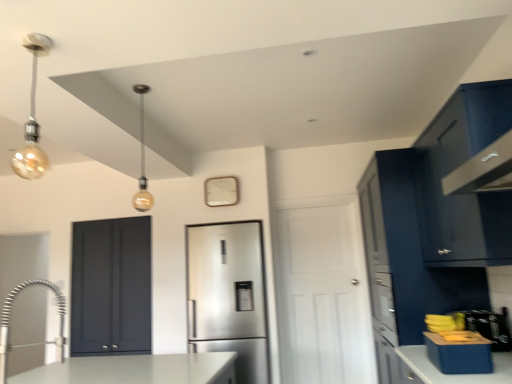
Question: In the image, is gold bulb at upper left, which appears as the second light fixture when viewed from the back, positioned in front of or behind matte dark blue cabinet at left, the second door positioned from the right?

Choices:
 (A) behind
 (B) front

Answer: (B)

Question: From a real-world perspective, is gold bulb at upper left, the second light fixture from the right, above or below matte dark blue cabinet at left, which appears as the 1th door when viewed from the left?

Choices:
 (A) below
 (B) above

Answer: (B)

Question: Which is farther from the satin stainless steel refrigerator at center?

Choices:
 (A) matte blue cabinet at right, which is the 1th cabinetry from back to front
 (B) satin nickel faucet at lower left
 (C) gold metallic light bulb at upper left, acting as the 2th light fixture starting from the left
 (D) metallic square clock at upper center
 (E) glossy dark blue cabinet at upper right, which appears as the 2th cabinetry when viewed from the back

Answer: (E)

Question: Which object is the farthest from the glossy dark blue cabinet at upper right, which ranks as the first cabinetry in front-to-back order?

Choices:
 (A) satin stainless steel refrigerator at center
 (B) satin nickel faucet at lower left
 (C) gold bulb at upper left, arranged as the first light fixture when viewed from the left
 (D) gold metallic light bulb at upper left, the 1th light fixture positioned from the right
 (E) white matte door at center, which is counted as the 1th door, starting from the right

Answer: (D)